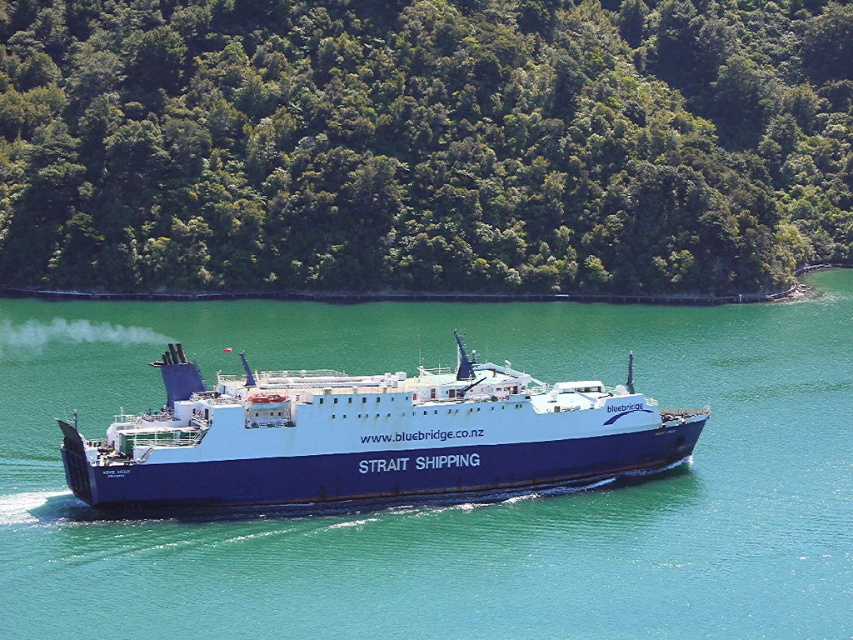
You are a bird flying over the scene. You see the green leafy trees at center and the blue matte ship at center. Which one is higher from the water surface?

The green leafy trees at center are taller than the blue matte ship at center, so they are higher from the water surface.